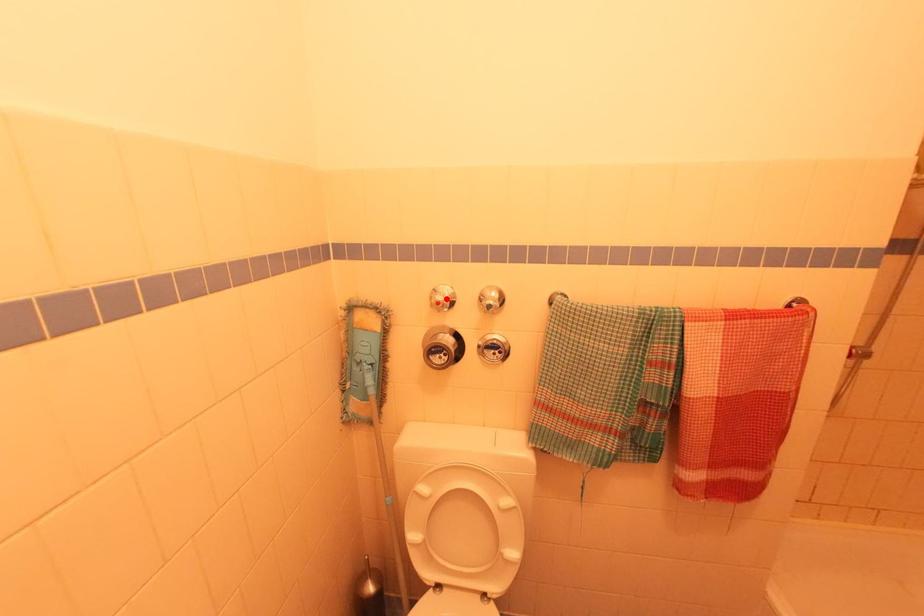
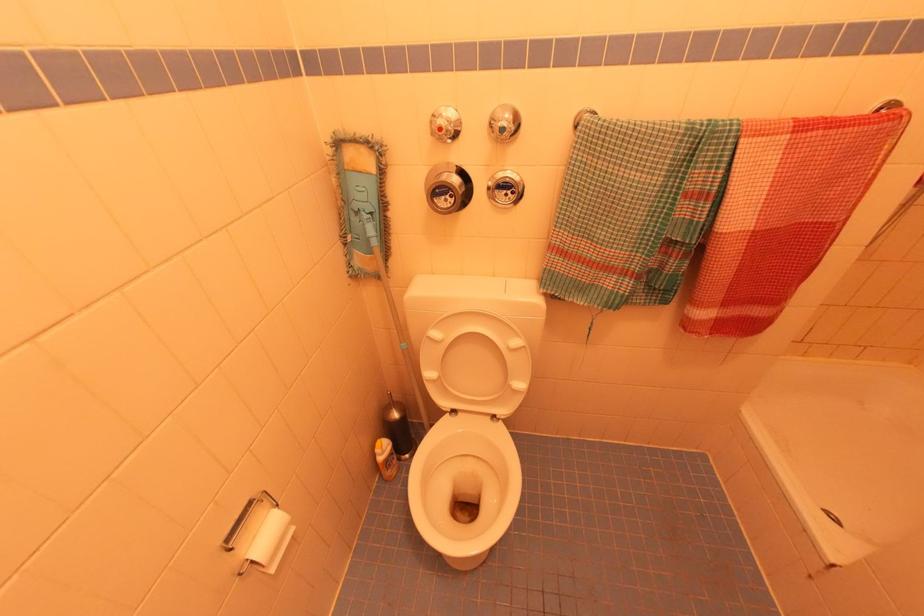
In the second image, find the point that corresponds to the highlighted location in the first image.

(450, 123)